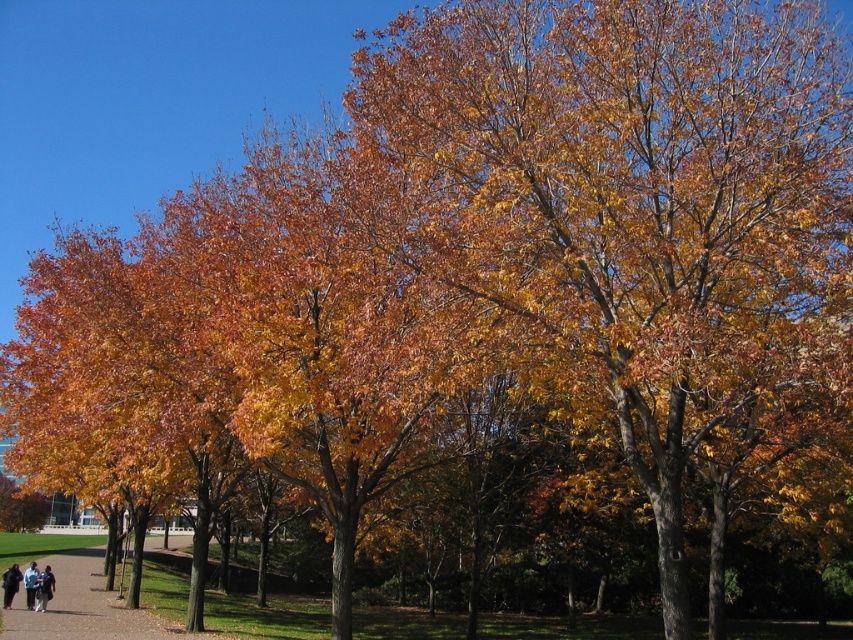
Is point (39, 608) positioned after point (4, 584)?

No, it is not.

Does dark blue jeans at lower left have a lesser width compared to dark brown leather jacket at lower left?

Indeed, dark blue jeans at lower left has a lesser width compared to dark brown leather jacket at lower left.

I want to click on dark blue jeans at lower left, so click(44, 588).

At what (x,y) coordinates should I click in order to perform the action: click on dark blue jeans at lower left. Please return your answer as a coordinate pair (x, y). This screenshot has height=640, width=853. Looking at the image, I should click on (44, 588).

Does dark blue jeans at lower left appear over light blue denim jacket at lower left?

Yes.

Who is taller, dark blue jeans at lower left or light blue denim jacket at lower left?

With more height is light blue denim jacket at lower left.

The width and height of the screenshot is (853, 640). I want to click on dark blue jeans at lower left, so click(x=44, y=588).

Locate an element on the screen. The width and height of the screenshot is (853, 640). dark blue jeans at lower left is located at coordinates (44, 588).

Can you confirm if dark brown leather jacket at lower left is positioned below light blue denim jacket at lower left?

Actually, dark brown leather jacket at lower left is above light blue denim jacket at lower left.

Is dark brown leather jacket at lower left positioned at the back of light blue denim jacket at lower left?

Yes, it is behind light blue denim jacket at lower left.

Is point (15, 580) less distant than point (25, 602)?

Yes, it is in front of point (25, 602).

What are the coordinates of `dark brown leather jacket at lower left` in the screenshot? It's located at (10, 582).